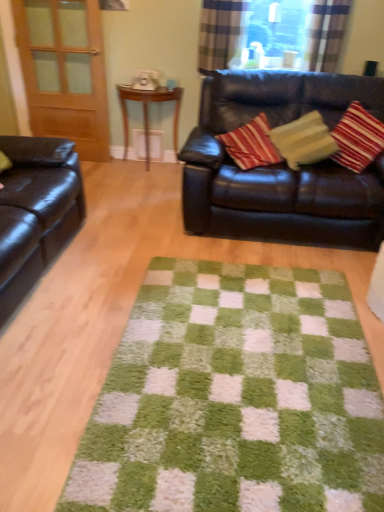
I want to click on free area in between shiny brown leather couch at left, the first studio couch positioned from the left, and green shaggy rug at center, so click(x=89, y=318).